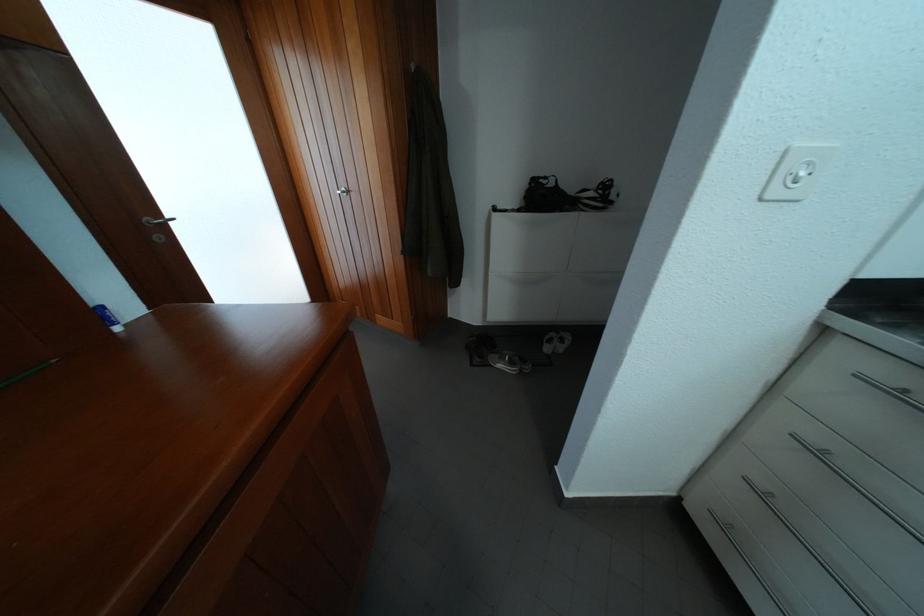
Find where to pull the silver door handle. Please return your answer as a coordinate pair (x, y).

(156, 221)